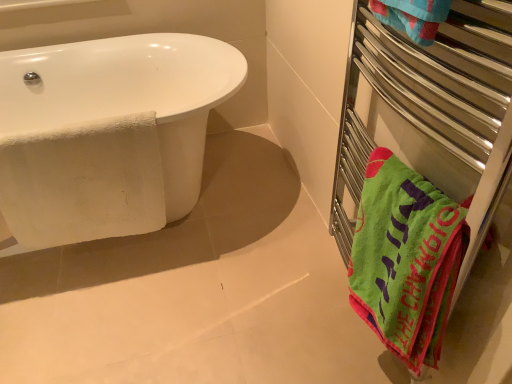
The image size is (512, 384). Find the location of `blank space situated above green soft towel at right (from a real-world perspective)`. blank space situated above green soft towel at right (from a real-world perspective) is located at coordinates (409, 180).